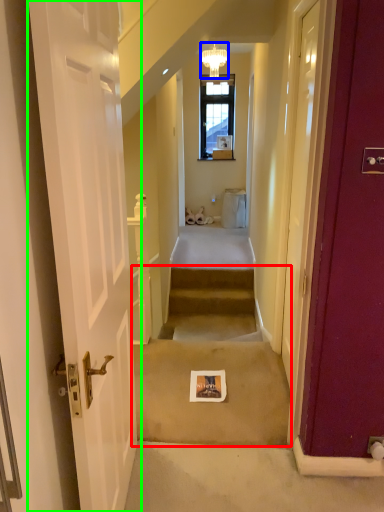
Question: Which is farther away from stairwell (highlighted by a red box)? light fixture (highlighted by a blue box) or door (highlighted by a green box)?

Choices:
 (A) light fixture
 (B) door

Answer: (A)